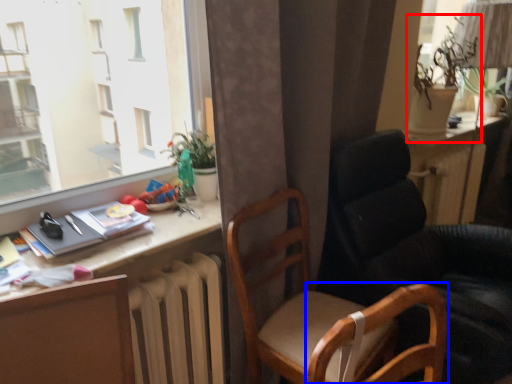
Question: Which object is further to the camera taking this photo, houseplant (highlighted by a red box) or swivel chair (highlighted by a blue box)?

Choices:
 (A) houseplant
 (B) swivel chair

Answer: (A)